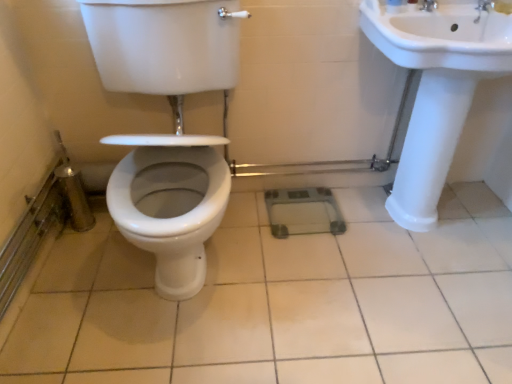
This screenshot has width=512, height=384. What are the coordinates of `free space to the left of white glossy toilet at center` in the screenshot? It's located at (73, 277).